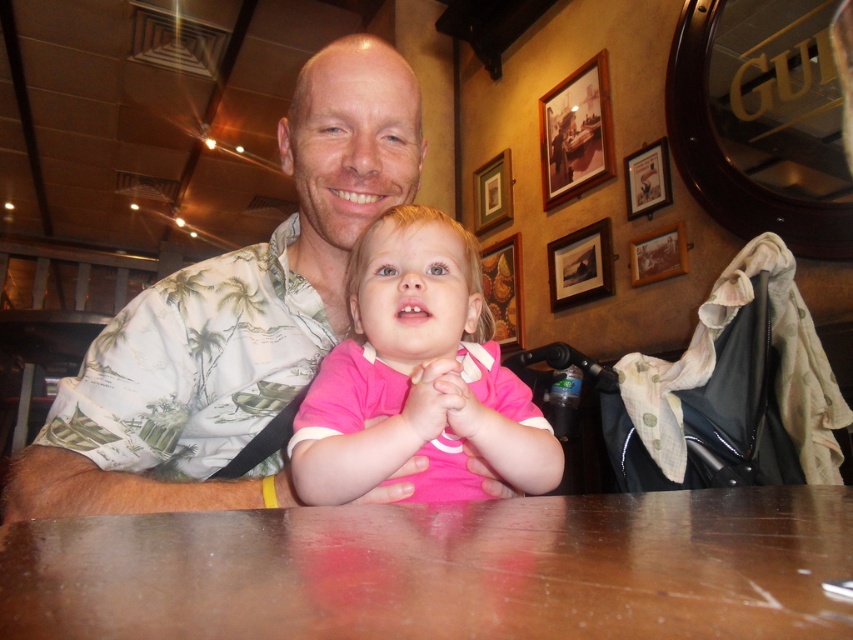
Question: In this image, where is wooden table at center located relative to printed palm tree shirt at center?

Choices:
 (A) right
 (B) left

Answer: (A)

Question: Which object is positioned closest to the wooden picture frame at upper right?

Choices:
 (A) wooden picture frame at upper center
 (B) printed palm tree shirt at center
 (C) pink matte shirt at center
 (D) wooden table at center

Answer: (A)

Question: Among these objects, which one is nearest to the camera?

Choices:
 (A) pink matte shirt at center
 (B) wooden picture frame at upper center

Answer: (A)

Question: Can you confirm if wooden table at center is thinner than wooden picture frame at upper center?

Choices:
 (A) yes
 (B) no

Answer: (B)

Question: Does printed palm tree shirt at center appear over wooden picture frame at upper right?

Choices:
 (A) no
 (B) yes

Answer: (A)

Question: Estimate the real-world distances between objects in this image. Which object is closer to the printed palm tree shirt at center?

Choices:
 (A) wooden picture frame at upper right
 (B) wooden picture frame at upper center
 (C) wooden table at center

Answer: (C)